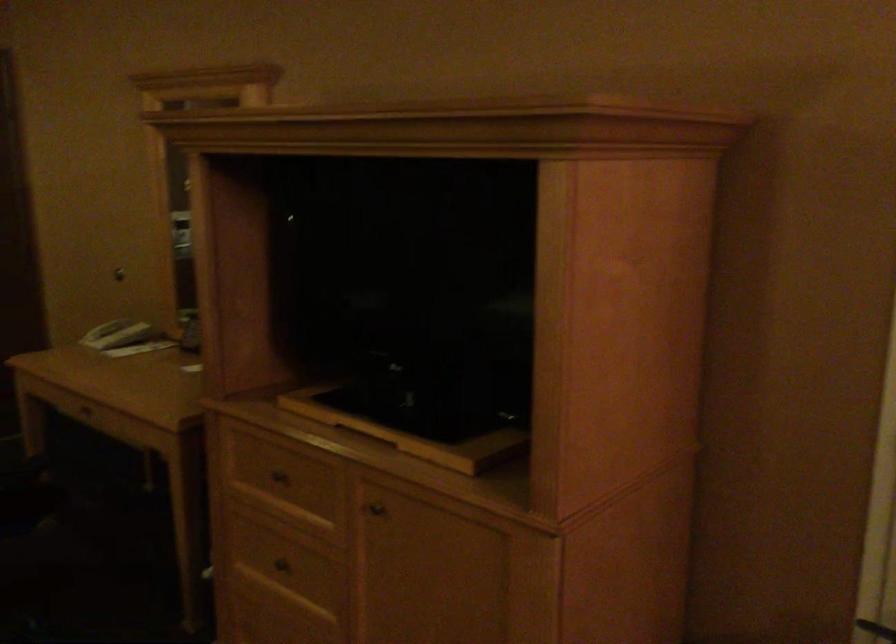
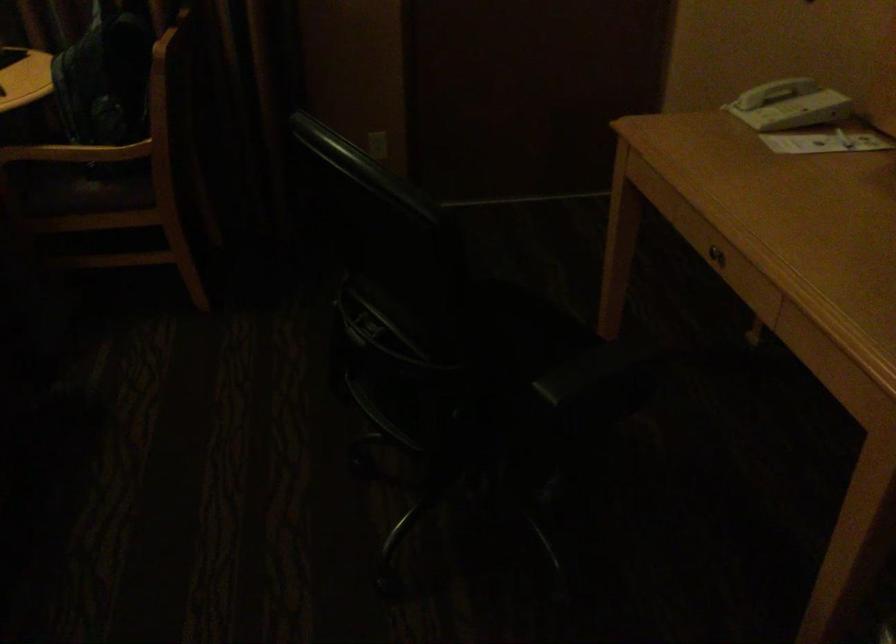
Locate, in the second image, the point that corresponds to (82,412) in the first image.

(714, 257)